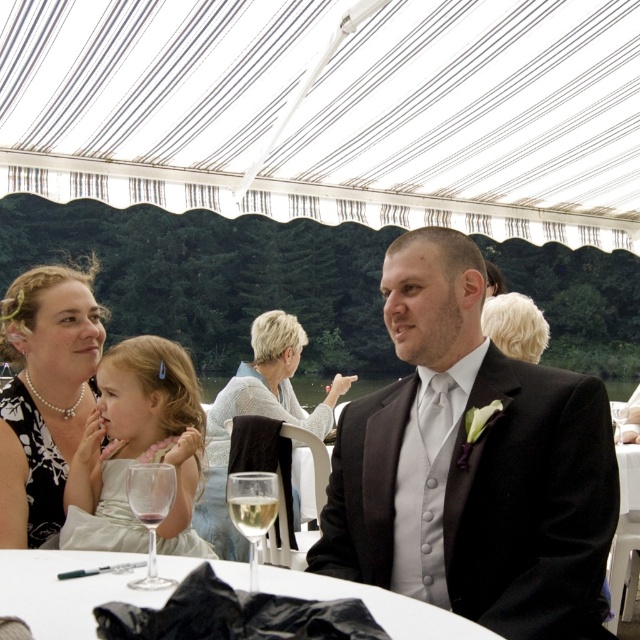
Can you confirm if clear glass wine at lower center is positioned to the left of clear glass wine at table front?

Incorrect, clear glass wine at lower center is not on the left side of clear glass wine at table front.

Which is behind, point (236, 504) or point (141, 512)?

Point (141, 512)

The image size is (640, 640). Describe the element at coordinates (252, 515) in the screenshot. I see `clear glass wine at lower center` at that location.

Identify the location of clear glass wine at lower center. (252, 515).

Who is higher up, matte black suit at center or clear glass wine glass at lower center?

Positioned higher is matte black suit at center.

Is point (444, 545) closer to camera compared to point (256, 508)?

That is False.

Is point (547, 429) positioned behind point (230, 484)?

Yes, point (547, 429) is farther from viewer.

Identify the location of matte black suit at center. (531, 500).

Is white satin dress at left in front of white glossy table at center?

No, white satin dress at left is behind white glossy table at center.

Who is higher up, white satin dress at left or white glossy table at center?

white satin dress at left is above.

Between point (81, 476) and point (275, 586), which one is positioned behind?

The point (81, 476) is behind.

Where is `white satin dress at left`? white satin dress at left is located at coordinates (138, 449).